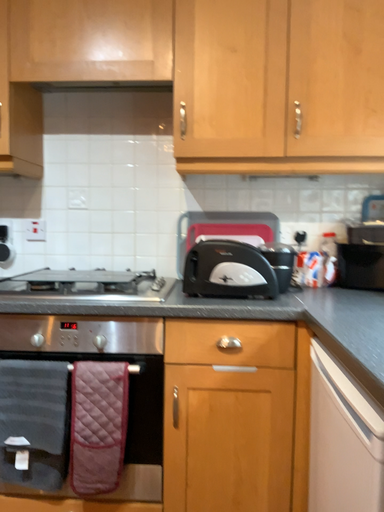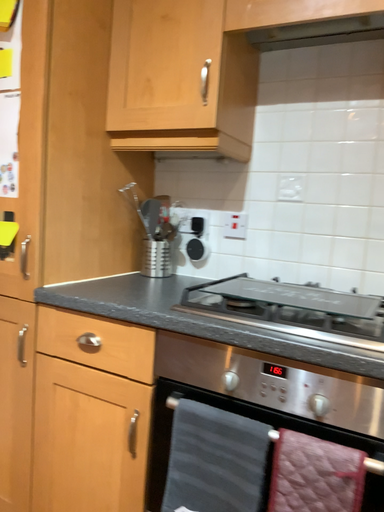
Question: How did the camera likely rotate when shooting the video?

Choices:
 (A) rotated left
 (B) rotated right

Answer: (A)